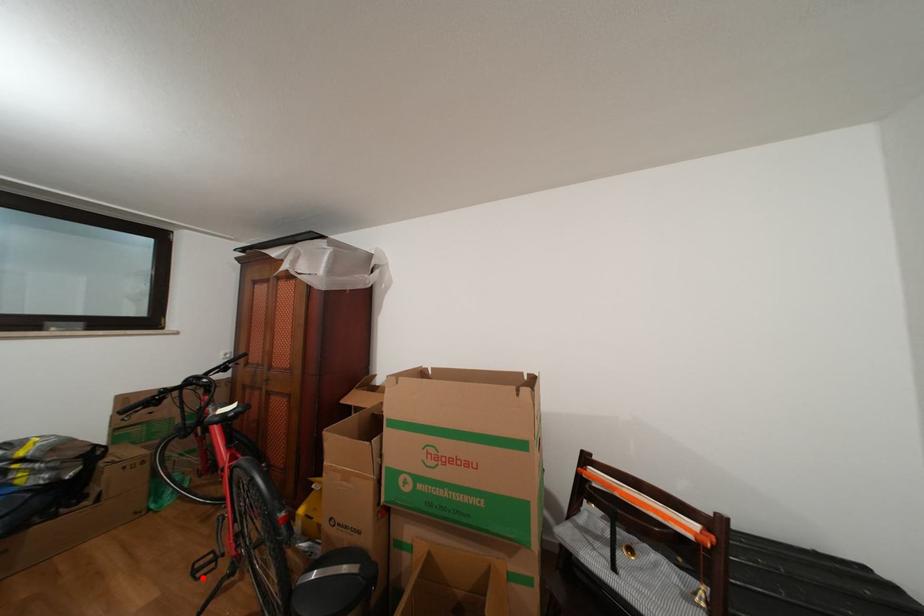
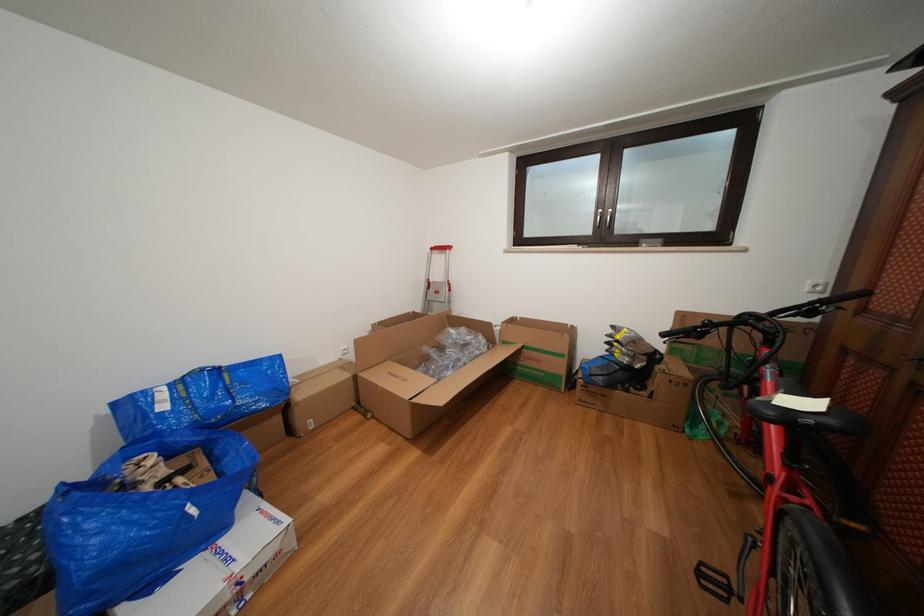
Question: I am providing you with two images of the same scene from different viewpoints. In image1, a red point is highlighted. Considering the same 3D point in image2, which of the following is correct?

Choices:
 (A) It is closer
 (B) It is farther

Answer: (B)